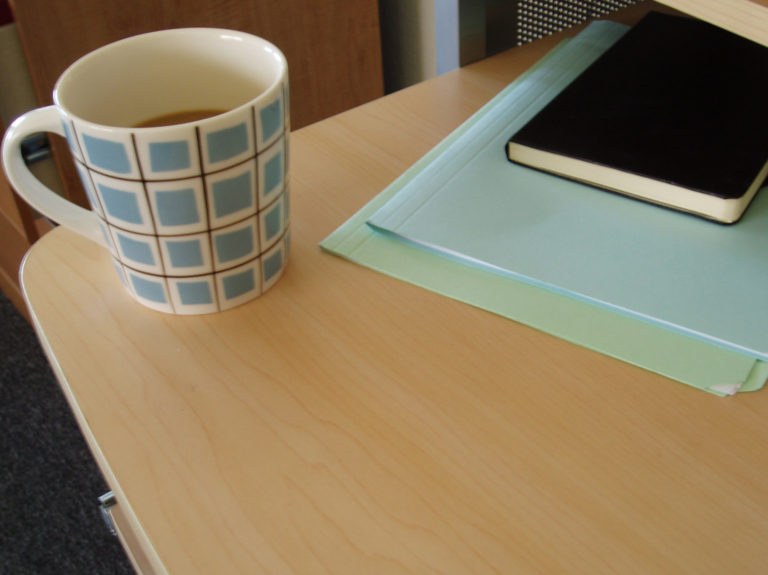
At what (x,y) coordinates should I click in order to perform the action: click on white pages of book. Please return your answer as a coordinate pair (x, y). This screenshot has width=768, height=575. Looking at the image, I should click on (554, 163).